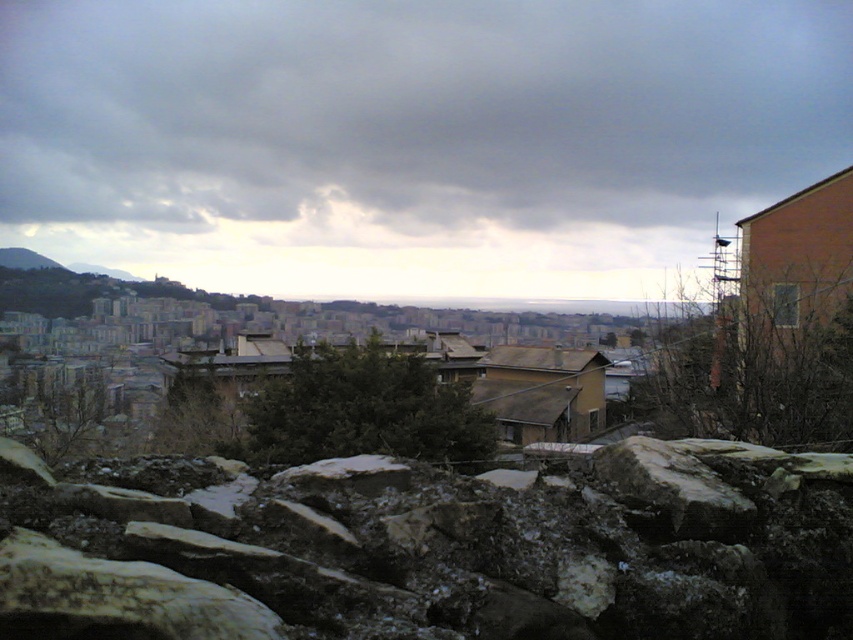
You are navigating through an urban area and need to reach a destination located at point [405,486]. You are currently at point [683,525]. Based on the spatial relationship between these two points, which direction should you move to reach your destination?

Point [405,486] is behind point [683,525]. Therefore, to reach your destination, you should move in the direction away from your current position, towards the area that is behind you relative to point [683,525].

You are standing in the urban area shown in the image. You see a rough stone wall at lower center and a white rough stone at center. Which one is located to the left of the other?

The rough stone wall at lower center is positioned on the left side of white rough stone at center.

You are standing in the urban area shown in the image. You notice a specific point marked at coordinates (412, 122). What object is located at this point?

The point at coordinates (412, 122) indicates a dark gray cloud at upper center.